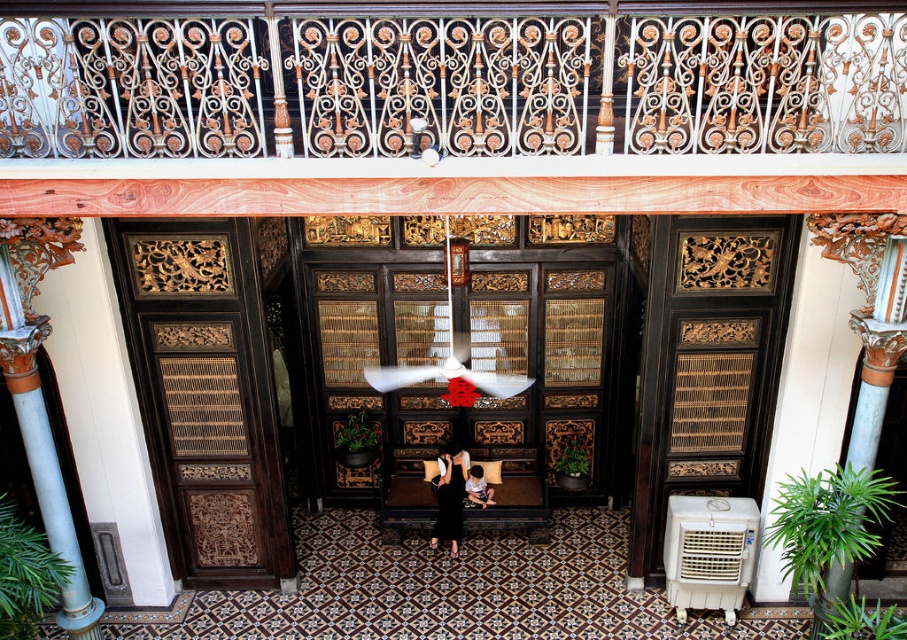
Is blue painted wood column at left taller than dark brown leather chair at center?

Yes.

Who is positioned more to the right, blue painted wood column at left or dark brown leather chair at center?

dark brown leather chair at center is more to the right.

What do you see at coordinates (47, 476) in the screenshot? The width and height of the screenshot is (907, 640). I see `blue painted wood column at left` at bounding box center [47, 476].

Locate an element on the screen. blue painted wood column at left is located at coordinates (47, 476).

Is blue painted wood column at left below black matte dress at center?

Actually, blue painted wood column at left is above black matte dress at center.

Identify the location of blue painted wood column at left. (47, 476).

Is point (61, 493) farther from viewer compared to point (444, 468)?

No, (61, 493) is in front of (444, 468).

This screenshot has height=640, width=907. What are the coordinates of `blue painted wood column at left` in the screenshot? It's located at (47, 476).

Who is higher up, white wrought iron railing at upper center or dark brown leather chair at center?

Positioned higher is white wrought iron railing at upper center.

Locate an element on the screen. The image size is (907, 640). white wrought iron railing at upper center is located at coordinates (446, 77).